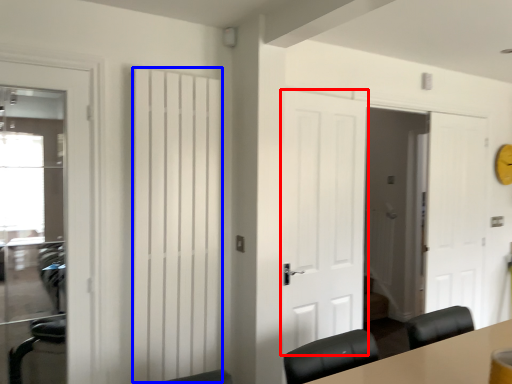
Question: Which of the following is the closest to the observer, door (highlighted by a red box) or curtain (highlighted by a blue box)?

Choices:
 (A) door
 (B) curtain

Answer: (B)